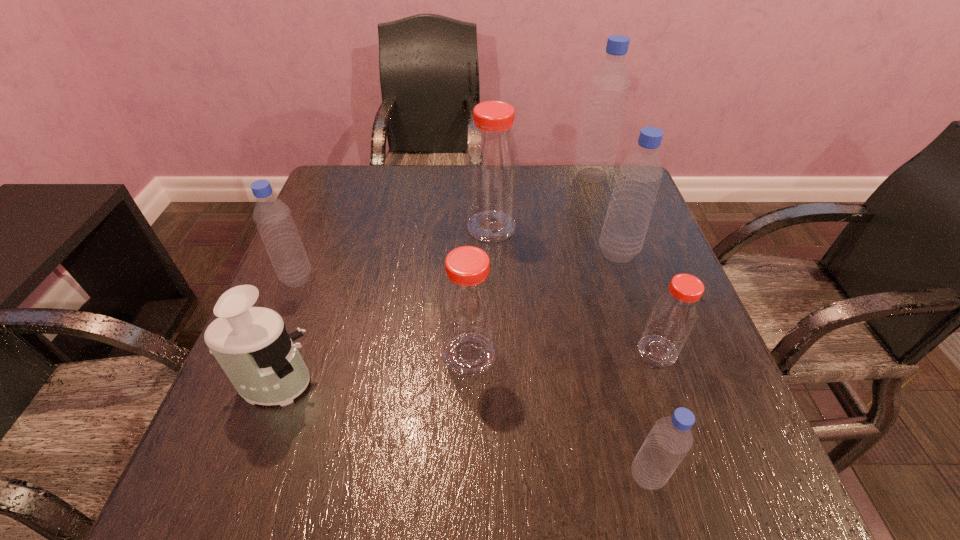
Identify which bottle is the fourth closest to the smallest blue bottle. Please provide its 2D coordinates. Your answer should be formatted as a tuple, i.e. [(x, y)], where the tuple contains the x and y coordinates of a point satisfying the conditions above.

[(492, 163)]

What are the coordinates of `bottle that is the fifth closest to the farthest red bottle` in the screenshot? It's located at 675,312.

Identify the location of blue bottle that stands as the second closest to the nearest bottle. This screenshot has height=540, width=960. (273, 218).

This screenshot has height=540, width=960. I want to click on blue bottle that is the fourth nearest to the biggest red bottle, so click(x=670, y=439).

Locate an element on the screen. the third closest red bottle to the second nearest blue bottle is located at coordinates (675, 312).

Locate an element on the screen. The image size is (960, 540). red bottle that can be found as the second closest to the third farthest blue bottle is located at coordinates (492, 163).

Locate an element on the screen. This screenshot has height=540, width=960. free space that satisfies the following two spatial constraints: 1. on the front side of the leftmost blue bottle; 2. on the right side of the nearest bottle is located at coordinates (216, 475).